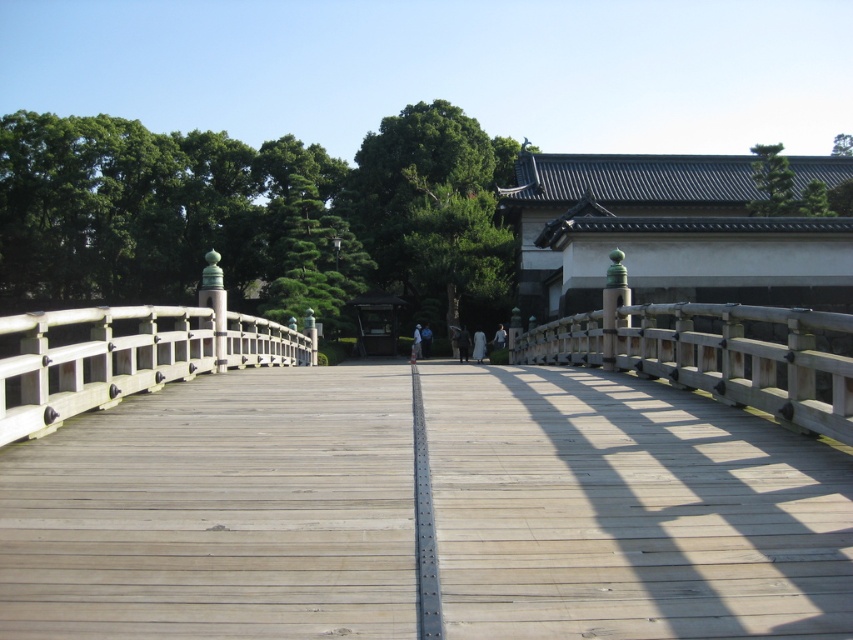
You are standing at the entrance of the park and want to cross the light brown wood bridge at center. According to the map, your current position is at point A. The bridge is at point B. What direction should you head to reach the bridge?

The light brown wood bridge at center is located at point B, so you should head towards point B from point A to reach the bridge.

You are standing on the path leading to the light brown wood bridge at center and want to reach the white wood rail at left. Which object will you encounter first as you move forward?

You will encounter the light brown wood bridge at center first because it is closer to you than the white wood rail at left.

You are a painter standing on the light brown wood bridge at center and want to paint the wooden rail at center. Based on the scene, which object is smaller in size?

The light brown wood bridge at center is smaller in size compared to the wooden rail at center according to the description.